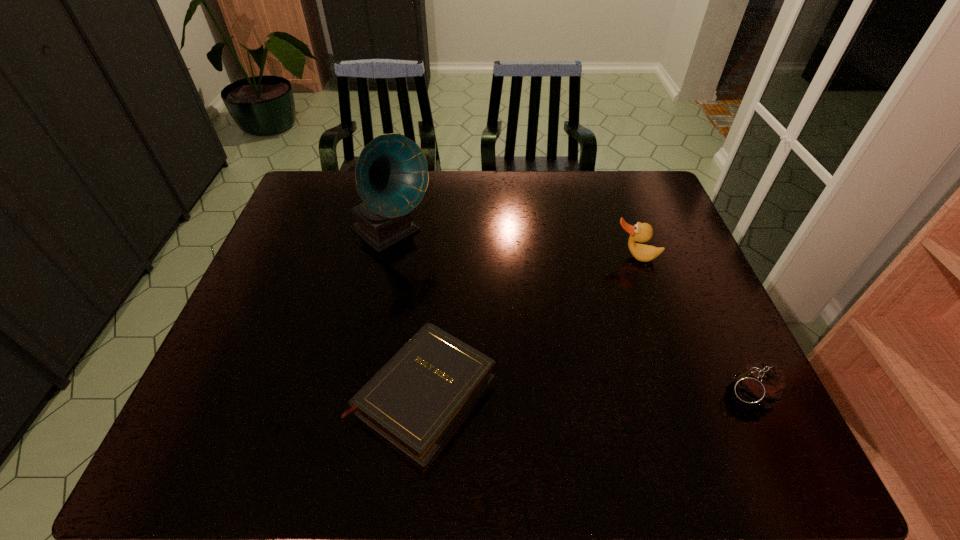
The image size is (960, 540). I want to click on unoccupied area between the second shortest object and the second object from right to left, so click(691, 325).

At what (x,y) coordinates should I click in order to perform the action: click on free space between the tallest object and the third tallest object. Please return your answer as a coordinate pair (x, y). Looking at the image, I should click on (569, 313).

This screenshot has height=540, width=960. I want to click on free space between the tallest object and the Bible, so click(x=407, y=314).

This screenshot has height=540, width=960. Identify the location of free space between the phonograph_record and the duck. (514, 246).

I want to click on free space that is in between the phonograph_record and the rightmost object, so click(x=569, y=313).

Identify the location of vacant space that is in between the Bible and the phonograph_record. (407, 314).

What are the coordinates of `object that is the second closest to the tallest object` in the screenshot? It's located at (641, 232).

Find the location of a particular element. The image size is (960, 540). the closest object to the rightmost object is located at coordinates (641, 232).

The height and width of the screenshot is (540, 960). Identify the location of vacant space that satisfies the following two spatial constraints: 1. on the front side of the third object from left to right; 2. on the left side of the phonograph_record. (386, 258).

Identify the location of vacant space that satisfies the following two spatial constraints: 1. on the front side of the second shortest object; 2. with a leaf charm attached to the duck. Image resolution: width=960 pixels, height=540 pixels. (683, 393).